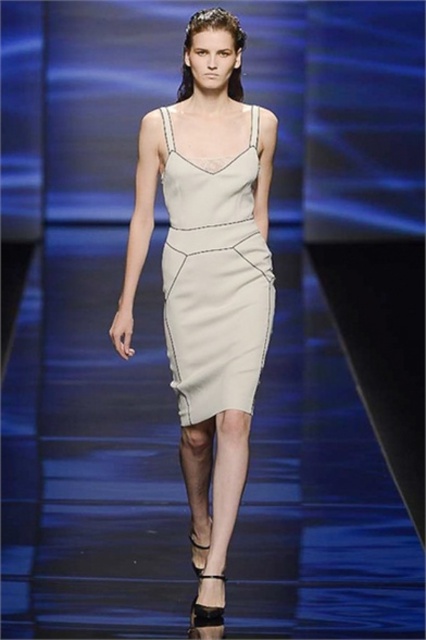
Question: Is satin dress at center to the right of satin beige dress at center from the viewer's perspective?

Choices:
 (A) yes
 (B) no

Answer: (B)

Question: Which object is farther from the camera taking this photo?

Choices:
 (A) satin dress at center
 (B) satin beige dress at center

Answer: (B)

Question: Which point is closer to the camera?

Choices:
 (A) click(x=170, y=260)
 (B) click(x=261, y=157)

Answer: (A)

Question: Which point is farther to the camera?

Choices:
 (A) (201, 264)
 (B) (207, 349)

Answer: (A)

Question: Can you confirm if satin dress at center is smaller than satin beige dress at center?

Choices:
 (A) yes
 (B) no

Answer: (B)

Question: Where is satin dress at center located in relation to satin beige dress at center in the image?

Choices:
 (A) left
 (B) right

Answer: (A)